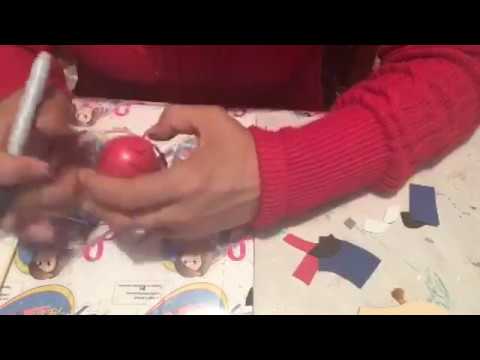
Find the location of a particular element. table's edge is located at coordinates (292, 112).